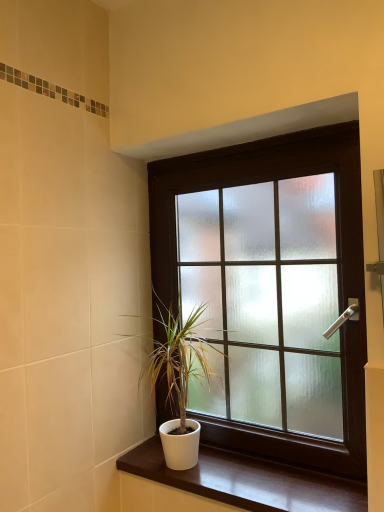
Locate an element on the screen. vacant space underneath frosted glass window at center (from a real-world perspective) is located at coordinates (291, 476).